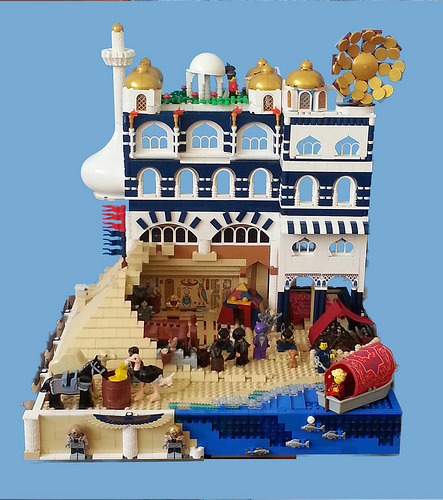
At what (x,y) coordinates should I click in order to perform the action: click on toy cat. Please return your answer as a coordinate pair (x, y). Looking at the image, I should click on (167, 380).